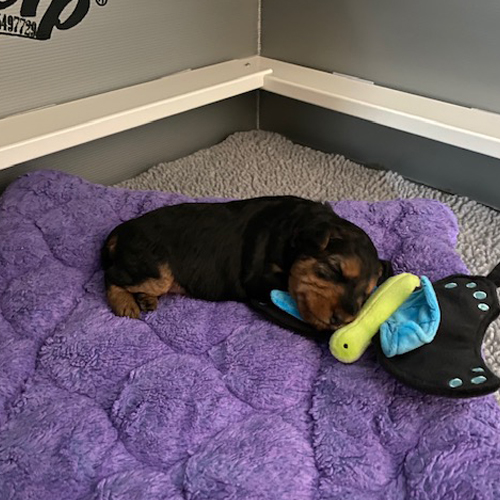
This screenshot has width=500, height=500. I want to click on carpet behind dog's bed, so click(x=264, y=169).